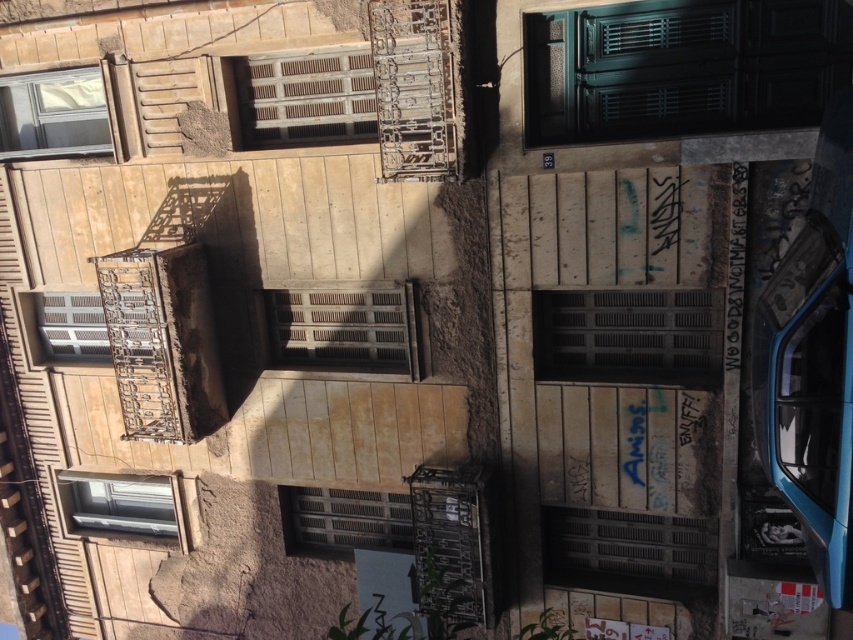
You are a delivery person with a cart that is 6 feet wide. You need to move your cart through the space between the green matte door at center and the dark gray matte shutter at center. Can your cart fit through the space between them?

The distance between the green matte door at center and the dark gray matte shutter at center is 6.75 feet. Since the cart is 6 feet wide, it can fit through the space as there is enough clearance.

You are standing in front of the building and want to reach the matte glass window at lower left. Is the brown wooden shutter at center blocking your direct path to it?

The brown wooden shutter at center is closer to the viewer than the matte glass window at lower left, so it may block your direct path to the matte glass window at lower left unless you move around it.